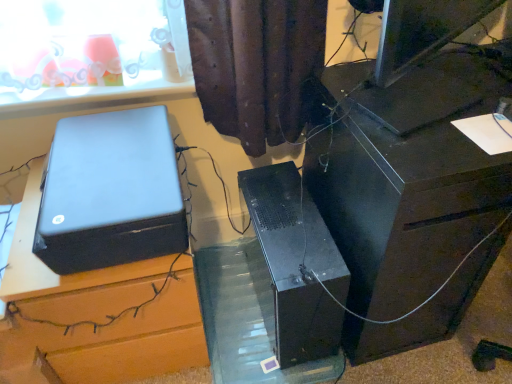
This screenshot has width=512, height=384. In order to click on free location above satin black printer at left (from a real-world perspective) in this screenshot , I will do `click(105, 159)`.